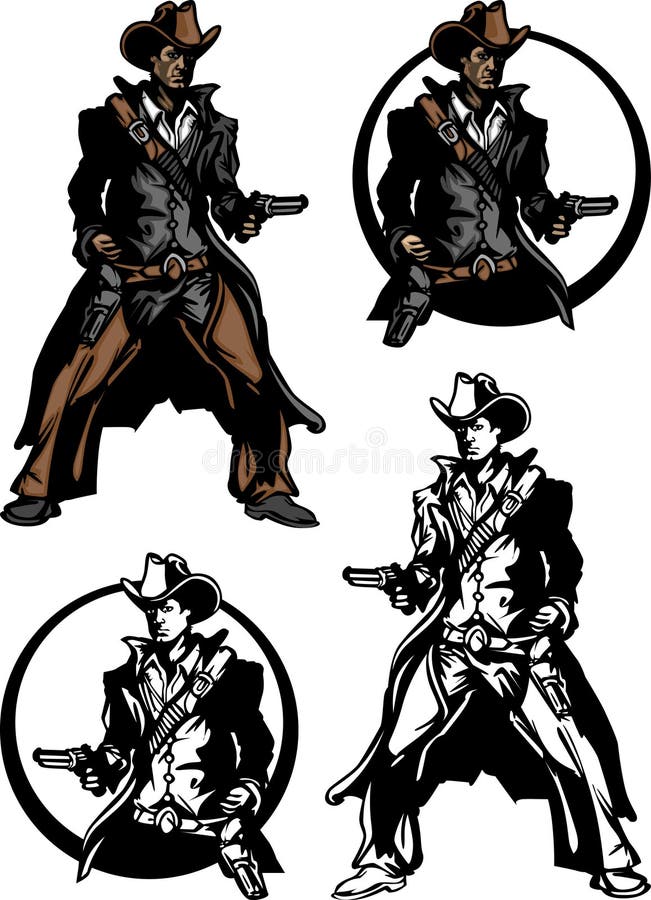
I want to click on white inner background, so click(x=74, y=706).